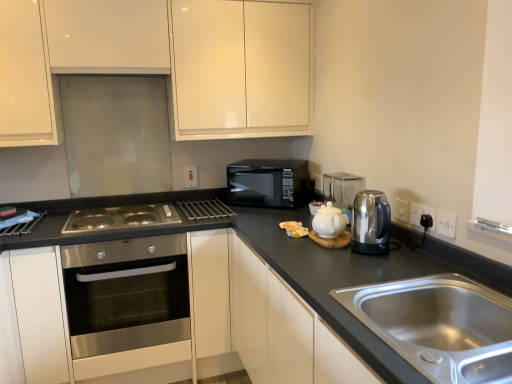
Measure the distance between point (422, 230) and camera.

Point (422, 230) and camera are 5.47 feet apart from each other.

Measure the distance between point [316,182] and camera.

The depth of point [316,182] is 8.55 feet.

You are a GUI agent. You are given a task and a screenshot of the screen. Output one action in this format:
    pyautogui.click(x=<x>, y=<y>)
    Task: Click on the white plastic electric outlet at center, arranged as the 1th electric outlet when viewed from the back
    Image resolution: width=512 pixels, height=384 pixels.
    Given the screenshot: What is the action you would take?
    [x=190, y=176]

Describe the element at coordinates (40, 314) in the screenshot. I see `stainless steel oven at lower left, arranged as the 2th cabinetry when viewed from the top` at that location.

At what (x,y) coordinates should I click in order to perform the action: click on black plastic socket at right, positioned as the second electric outlet in right-to-left order. Please return your answer as a coordinate pair (x, y). This screenshot has height=384, width=512. Looking at the image, I should click on (421, 215).

Who is taller, white glossy cabinets at upper center, the second cabinetry in the bottom-to-top sequence, or white plastic electric outlet at center, which is the 4th electric outlet from right to left?

white glossy cabinets at upper center, the second cabinetry in the bottom-to-top sequence.

From the image's perspective, which one is positioned lower, white glossy cabinets at upper center, acting as the first cabinetry starting from the top, or white plastic electric outlet at center, marked as the first electric outlet in a left-to-right arrangement?

white plastic electric outlet at center, marked as the first electric outlet in a left-to-right arrangement, appears lower in the image.

Does point (2, 126) come closer to viewer compared to point (186, 174)?

Yes, it is in front of point (186, 174).

Between white glossy cabinets at upper center, the second cabinetry in the bottom-to-top sequence, and white plastic electric outlet at center, marked as the first electric outlet in a left-to-right arrangement, which one appears on the right side from the viewer's perspective?

white plastic electric outlet at center, marked as the first electric outlet in a left-to-right arrangement, is more to the right.

Is stainless steel oven at lower left, arranged as the 1th cabinetry when ordered from the bottom, at the left side of black matte microwave at center?

Yes, stainless steel oven at lower left, arranged as the 1th cabinetry when ordered from the bottom, is to the left of black matte microwave at center.

Find the location of `cabinetry below the black matte microwave at center (from a real-world perspective)`. cabinetry below the black matte microwave at center (from a real-world perspective) is located at coordinates (40, 314).

From the image's perspective, is stainless steel oven at lower left, arranged as the 2th cabinetry when viewed from the top, above black matte microwave at center?

Incorrect, from the image's perspective, stainless steel oven at lower left, arranged as the 2th cabinetry when viewed from the top, is lower than black matte microwave at center.

Is point (35, 266) in front of point (282, 197)?

Yes, point (35, 266) is in front of point (282, 197).

Looking at this image, is polished stainless steel cooktop at lower left oriented away from stainless steel oven at center-left?

Absolutely, polished stainless steel cooktop at lower left is directed away from stainless steel oven at center-left.

From a real-world perspective, is polished stainless steel cooktop at lower left on stainless steel oven at center-left?

Indeed, from a real-world perspective, polished stainless steel cooktop at lower left stands above stainless steel oven at center-left.

Who is smaller, polished stainless steel cooktop at lower left or stainless steel oven at center-left?

Smaller between the two is polished stainless steel cooktop at lower left.

Is white glossy cabinets at upper center, acting as the first cabinetry starting from the top, inside stainless steel oven at center-left?

No, stainless steel oven at center-left does not contain white glossy cabinets at upper center, acting as the first cabinetry starting from the top.

In order to click on cabinetry on the right of stainless steel oven at center-left in this screenshot , I will do `click(163, 62)`.

Between stainless steel oven at center-left and white glossy cabinets at upper center, acting as the first cabinetry starting from the top, which one has larger width?

Wider between the two is stainless steel oven at center-left.

From a real-world perspective, is stainless steel oven at center-left on top of white glossy cabinets at upper center, acting as the first cabinetry starting from the top?

Actually, stainless steel oven at center-left is physically below white glossy cabinets at upper center, acting as the first cabinetry starting from the top, in the real world.

Is polished stainless steel cooktop at lower left wider or thinner than white plastic electric outlet at right, positioned as the fourth electric outlet in left-to-right order?

polished stainless steel cooktop at lower left is wider than white plastic electric outlet at right, positioned as the fourth electric outlet in left-to-right order.

Is polished stainless steel cooktop at lower left behind white plastic electric outlet at right, placed as the 1th electric outlet when sorted from front to back?

Yes, it is behind white plastic electric outlet at right, placed as the 1th electric outlet when sorted from front to back.

Which object is positioned more to the right, polished stainless steel cooktop at lower left or white plastic electric outlet at right, the first electric outlet when ordered from right to left?

Positioned to the right is white plastic electric outlet at right, the first electric outlet when ordered from right to left.

Which of these two, polished stainless steel cooktop at lower left or white plastic electric outlet at right, positioned as the fourth electric outlet in left-to-right order, is smaller?

Smaller between the two is white plastic electric outlet at right, positioned as the fourth electric outlet in left-to-right order.

From the image's perspective, is stainless steel oven at lower left, arranged as the 1th cabinetry when ordered from the bottom, beneath black plastic socket at right, arranged as the second electric outlet when viewed from the front?

Yes, from the image's perspective, stainless steel oven at lower left, arranged as the 1th cabinetry when ordered from the bottom, is beneath black plastic socket at right, arranged as the second electric outlet when viewed from the front.

Based on the photo, is stainless steel oven at lower left, arranged as the 2th cabinetry when viewed from the top, to the left of black plastic socket at right, which ranks as the third electric outlet in left-to-right order, from the viewer's perspective?

Correct, you'll find stainless steel oven at lower left, arranged as the 2th cabinetry when viewed from the top, to the left of black plastic socket at right, which ranks as the third electric outlet in left-to-right order.

Which is in front, stainless steel oven at lower left, arranged as the 2th cabinetry when viewed from the top, or black plastic socket at right, arranged as the second electric outlet when viewed from the front?

black plastic socket at right, arranged as the second electric outlet when viewed from the front.

Who is shorter, stainless steel oven at lower left, arranged as the 2th cabinetry when viewed from the top, or black plastic socket at right, positioned as the 3th electric outlet in back-to-front order?

black plastic socket at right, positioned as the 3th electric outlet in back-to-front order.

From the image's perspective, is white plastic electric outlet at upper center, positioned as the second electric outlet in left-to-right order, beneath stainless steel oven at lower left, arranged as the 2th cabinetry when viewed from the top?

No, from the image's perspective, white plastic electric outlet at upper center, positioned as the second electric outlet in left-to-right order, is not below stainless steel oven at lower left, arranged as the 2th cabinetry when viewed from the top.

Where is `the 1st electric outlet behind when counting from the stainless steel oven at lower left, arranged as the 1th cabinetry when ordered from the bottom`? Image resolution: width=512 pixels, height=384 pixels. the 1st electric outlet behind when counting from the stainless steel oven at lower left, arranged as the 1th cabinetry when ordered from the bottom is located at coordinates (317, 181).

Which is less distant, (317, 188) or (37, 310)?

Point (317, 188) is positioned farther from the camera compared to point (37, 310).

Is white plastic electric outlet at upper center, which ranks as the third electric outlet in front-to-back order, behind stainless steel oven at lower left, arranged as the 2th cabinetry when viewed from the top?

Yes, the depth of white plastic electric outlet at upper center, which ranks as the third electric outlet in front-to-back order, is greater than that of stainless steel oven at lower left, arranged as the 2th cabinetry when viewed from the top.

You are a GUI agent. You are given a task and a screenshot of the screen. Output one action in this format:
    pyautogui.click(x=<x>, y=<y>)
    Task: Click on the electric outlet that is the 1st object directly below the white glossy cabinets at upper center, acting as the first cabinetry starting from the top (from a real-world perspective)
    
    Given the screenshot: What is the action you would take?
    pyautogui.click(x=190, y=176)

Locate an element on the screen. Image resolution: width=512 pixels, height=384 pixels. microwave oven located on the right of stainless steel oven at lower left, arranged as the 2th cabinetry when viewed from the top is located at coordinates (268, 183).

Considering their positions, is stainless steel sink at lower right positioned closer to stainless steel oven at center-left than stainless steel oven at lower left, arranged as the 2th cabinetry when viewed from the top?

stainless steel oven at lower left, arranged as the 2th cabinetry when viewed from the top, is closer to stainless steel oven at center-left.

Considering their positions, is stainless steel oven at lower left, arranged as the 1th cabinetry when ordered from the bottom, positioned further to white glossy tea pot at center than stainless steel sink at lower right?

stainless steel oven at lower left, arranged as the 1th cabinetry when ordered from the bottom, is positioned further to the anchor white glossy tea pot at center.

Looking at the image, which one is located closer to metallic silver rack at center, the 3th appliance from the front, white glossy tea pot at center or white plastic electric outlet at center, which appears as the 4th electric outlet when viewed from the front?

The object closer to metallic silver rack at center, the 3th appliance from the front, is white plastic electric outlet at center, which appears as the 4th electric outlet when viewed from the front.

Based on their spatial positions, is satin metallic kettle at right, the first appliance positioned from the right, or polished stainless steel cooktop at lower left further from stainless steel oven at center-left?

Based on the image, satin metallic kettle at right, the first appliance positioned from the right, appears to be further to stainless steel oven at center-left.

Based on their spatial positions, is polished stainless steel cooktop at lower left or white glossy tea pot at center closer to white plastic electric outlet at upper center, which ranks as the third electric outlet in front-to-back order?

Among the two, white glossy tea pot at center is located nearer to white plastic electric outlet at upper center, which ranks as the third electric outlet in front-to-back order.

Which object lies nearer to the anchor point white glossy tea pot at center, polished stainless steel cooktop at lower left or white glossy cabinets at upper center, acting as the first cabinetry starting from the top?

Based on the image, polished stainless steel cooktop at lower left appears to be nearer to white glossy tea pot at center.

When comparing their distances from polished stainless steel cooktop at lower left, does stainless steel oven at center-left or black plastic socket at right, positioned as the second electric outlet in right-to-left order, seem further?

Based on the image, black plastic socket at right, positioned as the second electric outlet in right-to-left order, appears to be further to polished stainless steel cooktop at lower left.

Estimate the real-world distances between objects in this image. Which object is closer to stainless steel oven at lower left, arranged as the 2th cabinetry when viewed from the top, black plastic socket at right, positioned as the second electric outlet in right-to-left order, or white glossy cabinets at upper center, the second cabinetry in the bottom-to-top sequence?

The object closer to stainless steel oven at lower left, arranged as the 2th cabinetry when viewed from the top, is white glossy cabinets at upper center, the second cabinetry in the bottom-to-top sequence.

At what (x,y) coordinates should I click in order to perform the action: click on microwave oven between stainless steel oven at lower left, arranged as the 1th cabinetry when ordered from the bottom, and satin silver kettle at upper right, the 2th appliance positioned from the right, in the horizontal direction. Please return your answer as a coordinate pair (x, y). The image size is (512, 384). Looking at the image, I should click on (268, 183).

The width and height of the screenshot is (512, 384). Identify the location of cabinetry located between stainless steel oven at lower left, arranged as the 1th cabinetry when ordered from the bottom, and white plastic electric outlet at right, placed as the 1th electric outlet when sorted from front to back, in the left-right direction. (163, 62).

Image resolution: width=512 pixels, height=384 pixels. I want to click on oven situated between stainless steel oven at lower left, arranged as the 2th cabinetry when viewed from the top, and white plastic electric outlet at right, the first electric outlet when ordered from right to left, from left to right, so click(x=126, y=294).

Locate an element on the screen. This screenshot has height=384, width=512. appliance between polished stainless steel cooktop at lower left and black matte microwave at center in the horizontal direction is located at coordinates (205, 209).